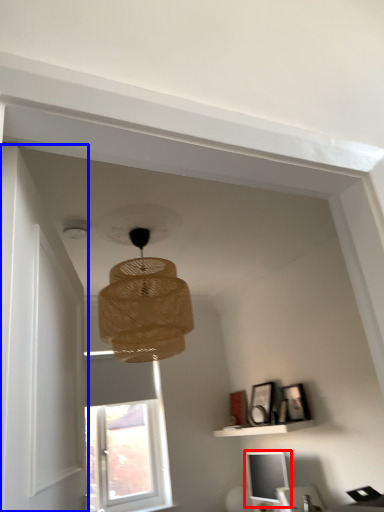
Question: Which point is further to the camera, computer monitor (highlighted by a red box) or door (highlighted by a blue box)?

Choices:
 (A) computer monitor
 (B) door

Answer: (A)